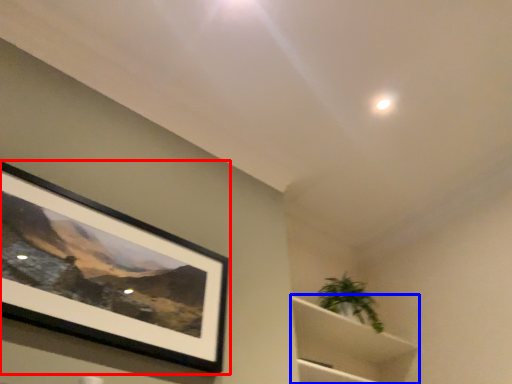
Question: Among these objects, which one is farthest to the camera, picture frame (highlighted by a red box) or cabinet (highlighted by a blue box)?

Choices:
 (A) picture frame
 (B) cabinet

Answer: (B)